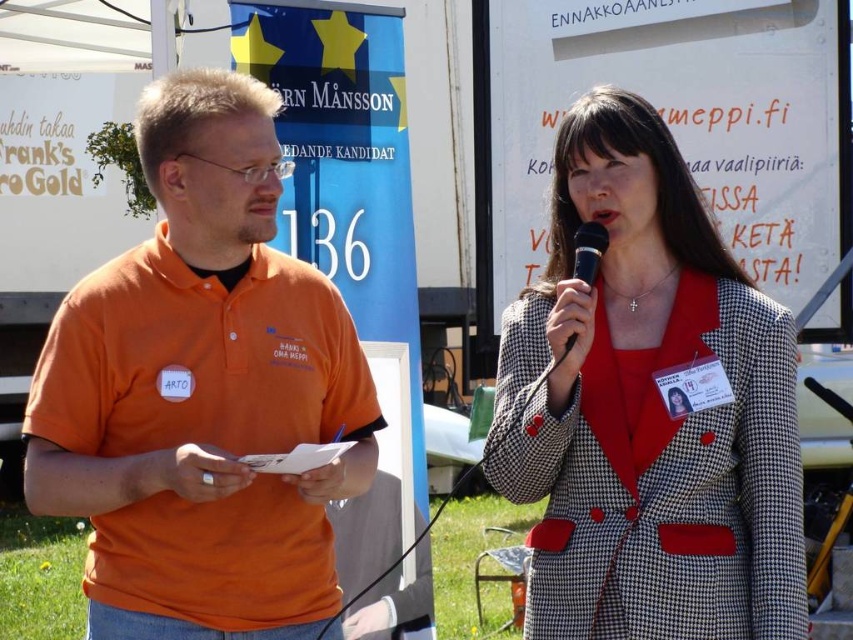
What are the coordinates of the houndstooth fabric blazer at center?

The houndstooth fabric blazer at center is located at coordinates point (x=648, y=408).

You are a photographer standing at the center of the scene. You need to take a photo that includes both the orange cotton polo shirt at left and the red blazer on the right. Based on their positions, which object is closer to the center of the frame?

The orange cotton polo shirt at left is positioned at point (202, 392), so it is closer to the center of the frame than the red blazer on the right.

You are a photographer at the event and need to capture a photo where both the orange cotton polo shirt at left and the houndstooth fabric blazer at center are visible. Based on their positions, which object is lower in the frame?

The orange cotton polo shirt at left is positioned under the houndstooth fabric blazer at center, so the orange cotton polo shirt at left is lower in the frame.